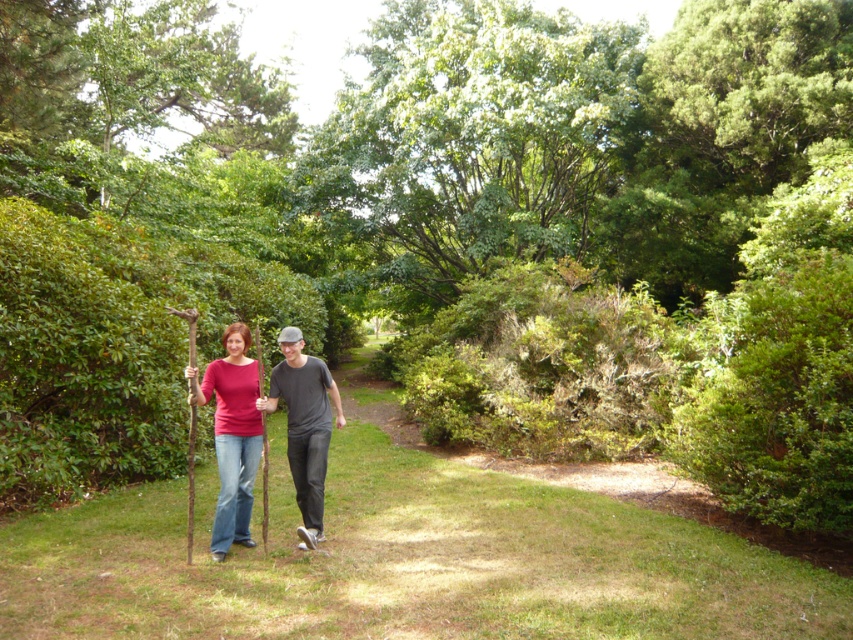
Does green leafy hedge at center appear on the left side of matte brown sticks at center?

Yes, green leafy hedge at center is to the left of matte brown sticks at center.

Measure the distance between green leafy hedge at center and camera.

The distance of green leafy hedge at center from camera is 20.22 feet.

Which is behind, point (59, 381) or point (239, 353)?

Positioned behind is point (59, 381).

Where is `green leafy hedge at center`? The height and width of the screenshot is (640, 853). green leafy hedge at center is located at coordinates (113, 344).

Is green leafy hedge at center to the right of green leafy bush at center from the viewer's perspective?

Incorrect, green leafy hedge at center is not on the right side of green leafy bush at center.

Does green leafy hedge at center appear on the left side of green leafy bush at center?

Indeed, green leafy hedge at center is positioned on the left side of green leafy bush at center.

The width and height of the screenshot is (853, 640). Describe the element at coordinates (113, 344) in the screenshot. I see `green leafy hedge at center` at that location.

Locate an element on the screen. Image resolution: width=853 pixels, height=640 pixels. green leafy hedge at center is located at coordinates (113, 344).

From the picture: Does green leafy bush at center come behind matte brown sticks at center?

Yes, green leafy bush at center is further from the viewer.

Who is lower down, green leafy bush at center or matte brown sticks at center?

Positioned lower is matte brown sticks at center.

You are a GUI agent. You are given a task and a screenshot of the screen. Output one action in this format:
    pyautogui.click(x=<x>, y=<y>)
    Task: Click on the green leafy bush at center
    
    Given the screenshot: What is the action you would take?
    pyautogui.click(x=538, y=365)